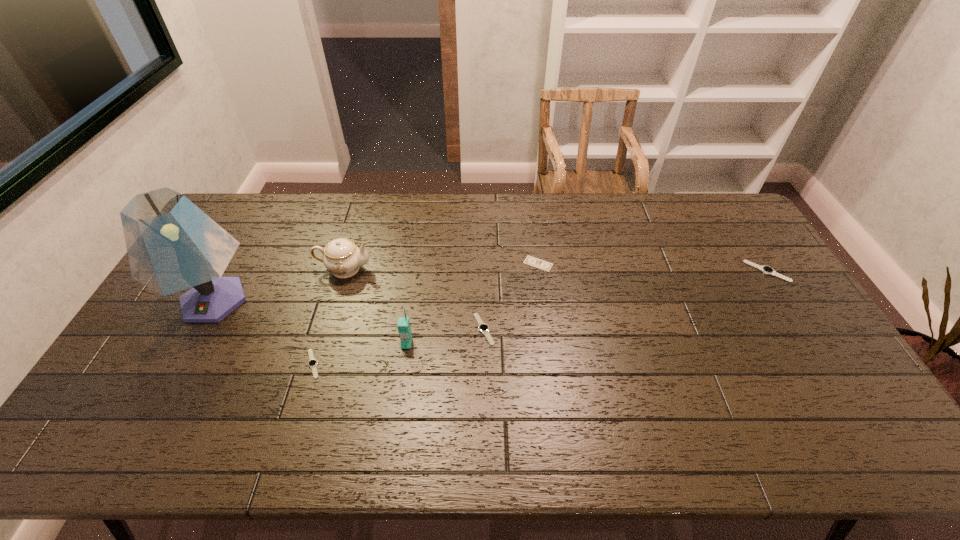
Identify the location of the nearest object. This screenshot has height=540, width=960. (312, 363).

At what (x,y) coordinates should I click in order to perform the action: click on the second shortest object. Please return your answer as a coordinate pair (x, y). The image size is (960, 540). Looking at the image, I should click on (312, 363).

Image resolution: width=960 pixels, height=540 pixels. I want to click on the fifth tallest object, so click(483, 328).

In order to click on the third object from right to left in this screenshot , I will do `click(483, 328)`.

Where is `the rightmost watch`? The width and height of the screenshot is (960, 540). the rightmost watch is located at coordinates (767, 270).

The height and width of the screenshot is (540, 960). In order to click on the rightmost object in this screenshot , I will do `click(767, 270)`.

This screenshot has height=540, width=960. I want to click on the tallest object, so click(172, 245).

Where is `lampshade`? lampshade is located at coordinates (172, 245).

Identify the location of chinaware. (341, 256).

The image size is (960, 540). In order to click on the fourth object from right to left in this screenshot , I will do [403, 325].